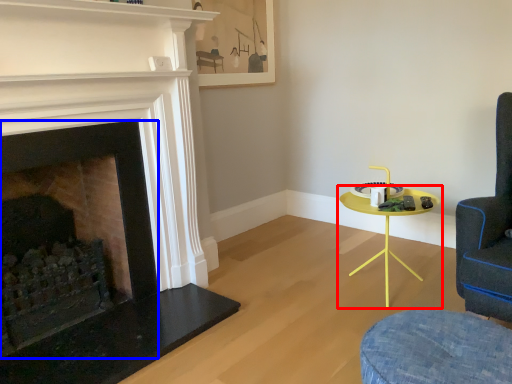
Question: Which point is closer to the camera, table (highlighted by a red box) or fireplace (highlighted by a blue box)?

Choices:
 (A) table
 (B) fireplace

Answer: (B)